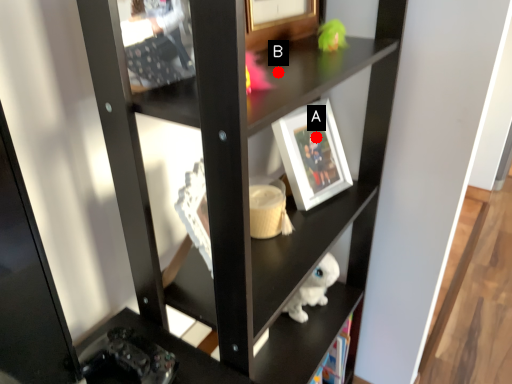
Question: Two points are circled on the image, labeled by A and B beside each circle. Among these points, which one is farthest from the camera?

Choices:
 (A) A is further
 (B) B is further

Answer: (A)